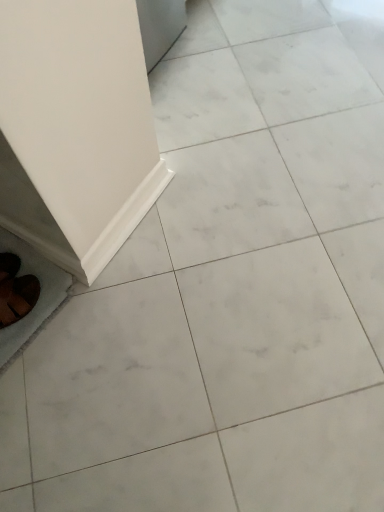
The image size is (384, 512). In order to click on free point to the right of white glossy ceramic tile at lower left, the first ceramic tile viewed from the left in this screenshot , I will do `click(110, 316)`.